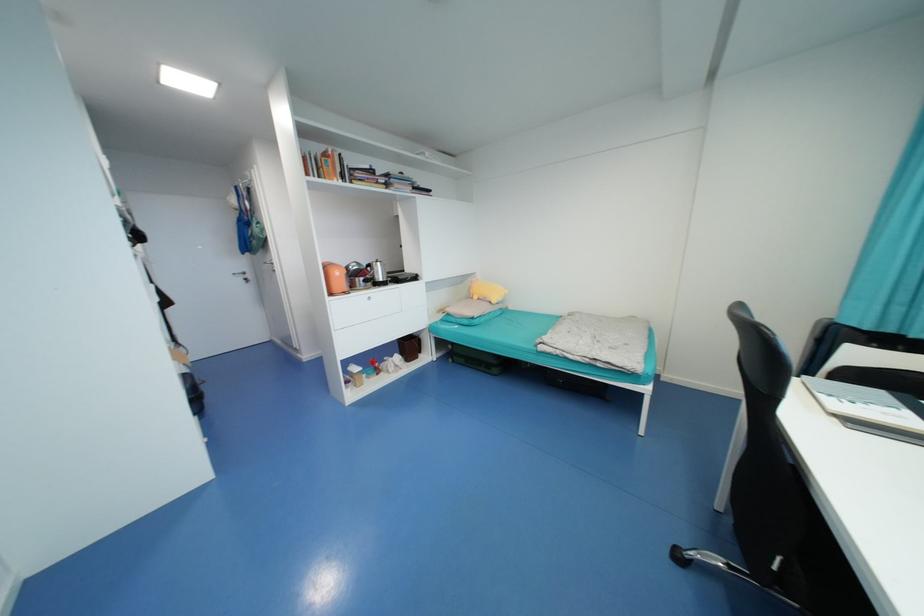
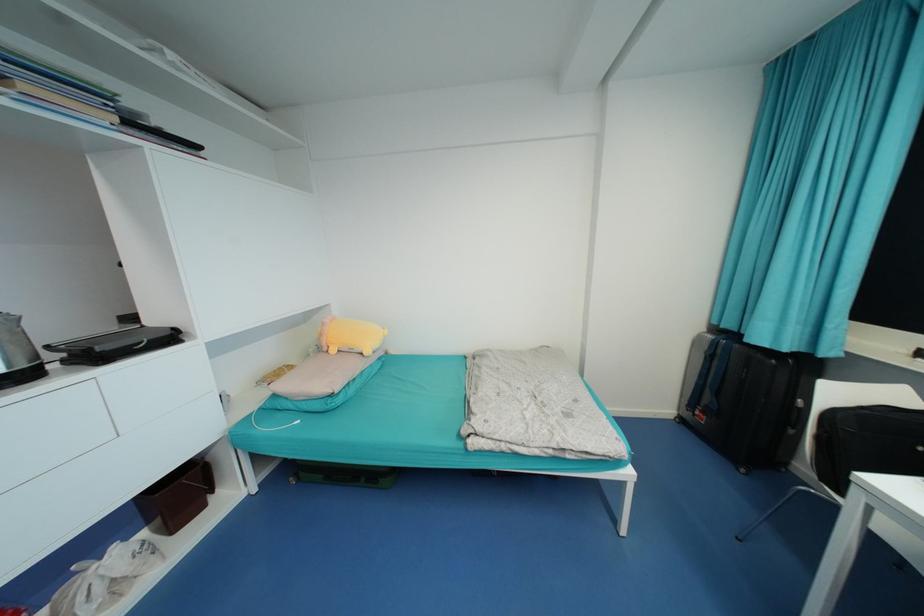
The point at (399, 187) is marked in the first image. Where is the corresponding point in the second image?

(28, 87)